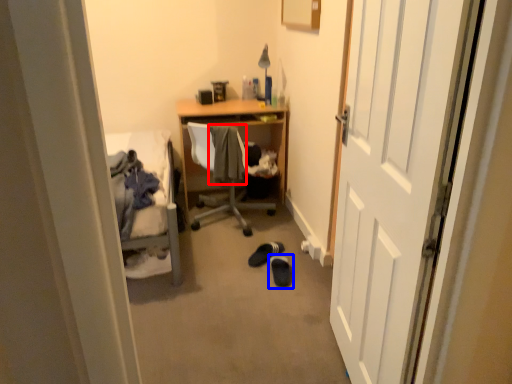
Question: Which object appears closest to the camera in this image, clothing (highlighted by a red box) or footwear (highlighted by a blue box)?

Choices:
 (A) clothing
 (B) footwear

Answer: (B)